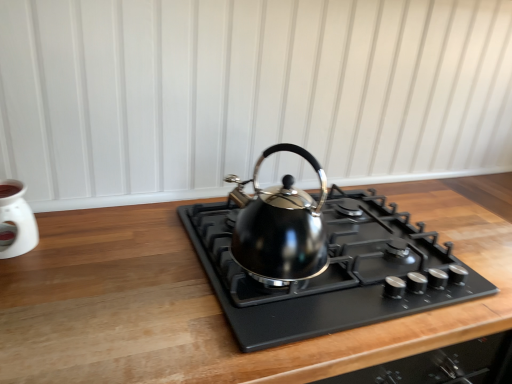
Question: Considering the positions of black metallic kettle at center and white glossy oil burner at left in the image, is black metallic kettle at center bigger or smaller than white glossy oil burner at left?

Choices:
 (A) big
 (B) small

Answer: (A)

Question: Is point (238, 231) closer or farther from the camera than point (16, 221)?

Choices:
 (A) closer
 (B) farther

Answer: (A)

Question: Estimate the real-world distances between objects in this image. Which object is farther from the white glossy oil burner at left?

Choices:
 (A) black metallic kettle at center
 (B) black matte gas stove at center

Answer: (B)

Question: Which object is positioned farthest from the black metallic kettle at center?

Choices:
 (A) black matte gas stove at center
 (B) white glossy oil burner at left

Answer: (B)